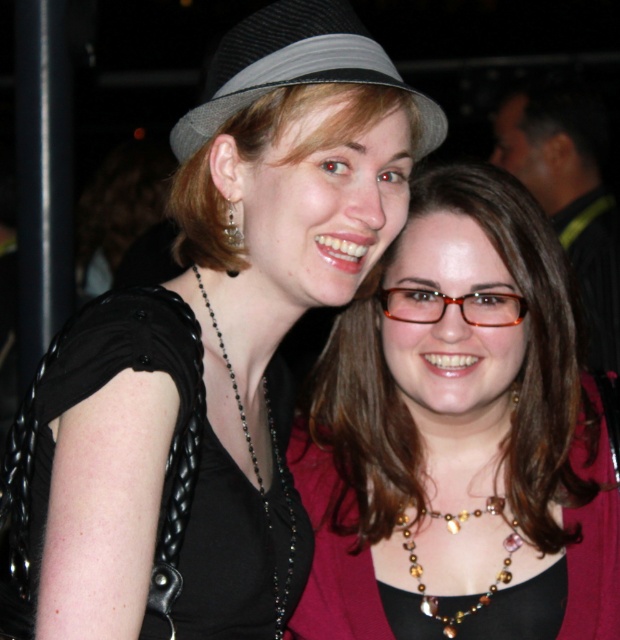
You are a photographer adjusting the camera focus. You need to ensure both the matte black necklace at center and the gray felt fedora at upper center are in focus. Which object should you focus on first to account for their size difference?

The matte black necklace at center is much taller than the gray felt fedora at upper center, so you should focus on the matte black necklace at center first to ensure its details are sharp before adjusting for the smaller fedora.

You are a photographer adjusting the lighting for a portrait. You notice the matte black necklace at center and the gray felt fedora at upper center. Which object is closer to the camera lens?

The gray felt fedora at upper center is closer to the camera lens because it is positioned above the matte black necklace at center, which is below it.